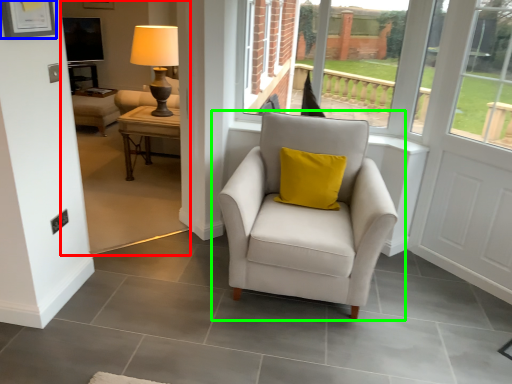
Question: Which is farther away from backyard (highlighted by a red box)? picture frame (highlighted by a blue box) or chair (highlighted by a green box)?

Choices:
 (A) picture frame
 (B) chair

Answer: (A)